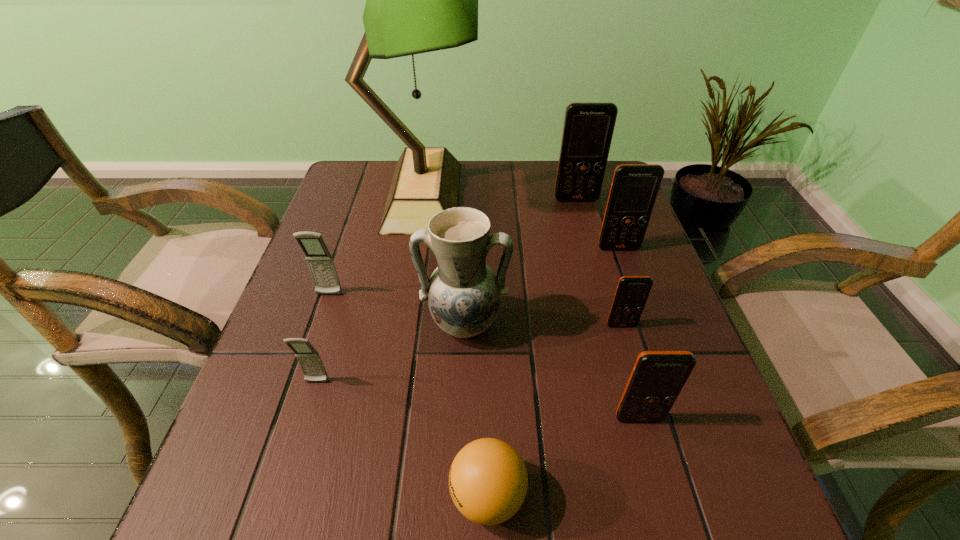
Locate an element on the screen. vacant area between the third nearest object and the nearest orange cellular telephone is located at coordinates (478, 400).

Image resolution: width=960 pixels, height=540 pixels. Identify the location of vacant area between the third farthest object and the pottery. (541, 286).

Image resolution: width=960 pixels, height=540 pixels. What are the coordinates of `free space between the seventh farthest object and the shortest object` in the screenshot? It's located at (402, 439).

You are a GUI agent. You are given a task and a screenshot of the screen. Output one action in this format:
    pyautogui.click(x=<x>, y=<y>)
    Task: Click on the free space between the second nearest orange cellular telephone and the pottery
    The image size is (960, 540).
    Given the screenshot: What is the action you would take?
    pyautogui.click(x=542, y=325)

Locate an element on the screen. This screenshot has width=960, height=540. empty location between the tallest object and the tallest cellular telephone is located at coordinates (499, 198).

This screenshot has height=540, width=960. Find the location of `vacant space in between the table lamp and the third nearest cellular telephone`. vacant space in between the table lamp and the third nearest cellular telephone is located at coordinates (522, 260).

What are the coordinates of `vacant area between the second tallest cellular telephone and the pottery` in the screenshot? It's located at (541, 286).

You are a GUI agent. You are given a task and a screenshot of the screen. Output one action in this format:
    pyautogui.click(x=<x>, y=<y>)
    Task: Click on the vacant space that is in between the smaller gray cellular telephone and the third biggest orange cellular telephone
    This screenshot has width=960, height=540.
    Given the screenshot: What is the action you would take?
    pyautogui.click(x=478, y=400)

You are a GUI agent. You are given a task and a screenshot of the screen. Output one action in this format:
    pyautogui.click(x=<x>, y=<y>)
    Task: Click on the free spot between the pottery and the smallest orange cellular telephone
    The height and width of the screenshot is (540, 960).
    Given the screenshot: What is the action you would take?
    pyautogui.click(x=542, y=325)

Locate which object is the fourth closest to the smaller gray cellular telephone. Please provide its 2D coordinates. Your answer should be formatted as a tuple, i.e. [(x, y)], where the tuple contains the x and y coordinates of a point satisfying the conditions above.

[(418, 0)]